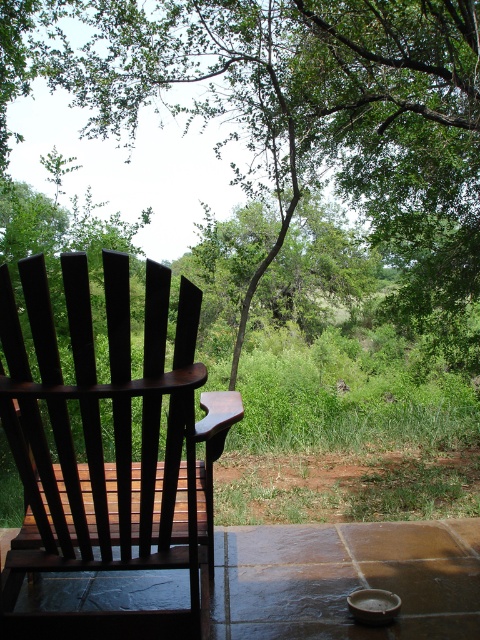
Is point (78, 48) farther from camera compared to point (433, 545)?

Yes, point (78, 48) is behind point (433, 545).

Can you confirm if green leafy tree at upper center is thinner than smooth stone porch at lower center?

Indeed, green leafy tree at upper center has a lesser width compared to smooth stone porch at lower center.

Does point (242, 180) come farther from viewer compared to point (58, 573)?

Yes, point (242, 180) is behind point (58, 573).

At what (x,y) coordinates should I click in order to perform the action: click on green leafy tree at upper center. Please return your answer as a coordinate pair (x, y). This screenshot has height=640, width=480. Looking at the image, I should click on (309, 109).

Looking at this image, is dark wood rocking chair at left to the left of smooth stone porch at lower center from the viewer's perspective?

Correct, you'll find dark wood rocking chair at left to the left of smooth stone porch at lower center.

Which is above, dark wood rocking chair at left or smooth stone porch at lower center?

dark wood rocking chair at left

Which is behind, point (116, 333) or point (325, 600)?

The point (325, 600) is behind.

Locate an element on the screen. This screenshot has width=480, height=640. dark wood rocking chair at left is located at coordinates (100, 445).

Between green leafy tree at upper center and dark wood rocking chair at left, which one is positioned lower?

Positioned lower is dark wood rocking chair at left.

Is point (407, 172) farther from viewer compared to point (167, 428)?

Yes.

Identify the location of green leafy tree at upper center. (309, 109).